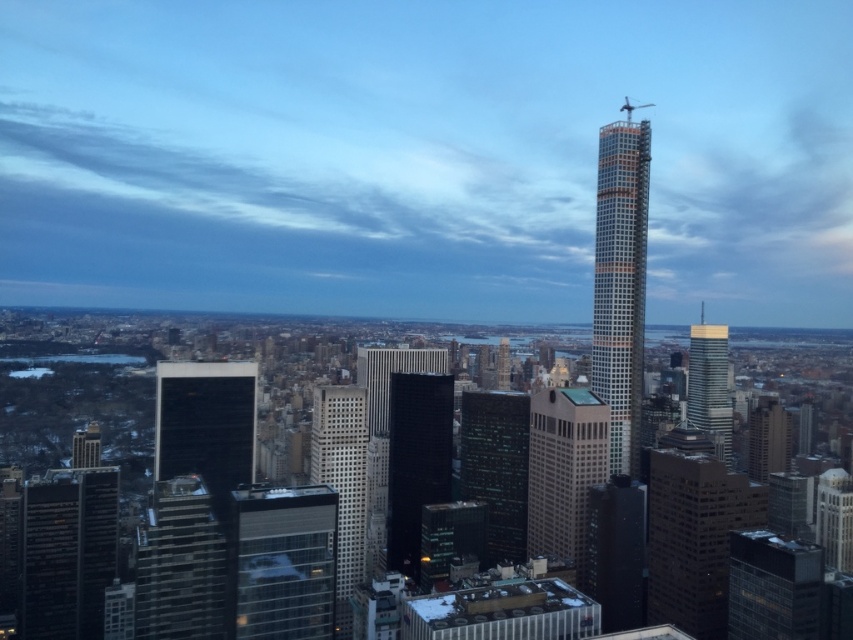
You are standing at the center of the city looking towards the skyline. There is a point at coordinate (68, 552). Which object does this point belong to?

The point at coordinate (68, 552) is on the dark glass skyscraper at lower left.

In the scene shown: You are a city planner reviewing this cityscape. You need to determine the relative positions of the dark glass skyscraper at center and the white glass skyscraper at center. Which one is positioned to the left?

The dark glass skyscraper at center is positioned to the left of the white glass skyscraper at center.